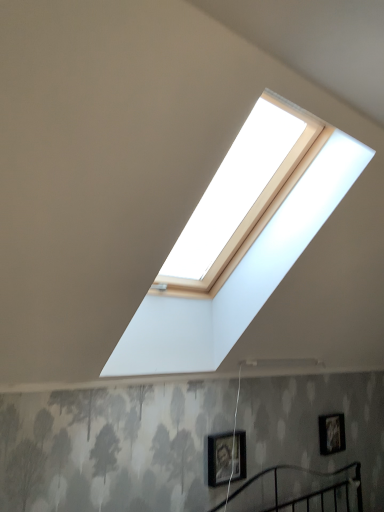
Question: Is matte black picture frame at lower right, marked as the second picture frame in a front-to-back arrangement, in front of or behind matte black picture frame at lower center, the 2th picture frame when ordered from back to front, in the image?

Choices:
 (A) front
 (B) behind

Answer: (B)

Question: Is matte black picture frame at lower right, which is the 1th picture frame from right to left, wider or thinner than matte black picture frame at lower center, the 2th picture frame when ordered from back to front?

Choices:
 (A) thin
 (B) wide

Answer: (A)

Question: Is matte black picture frame at lower right, which is the 1th picture frame from right to left, bigger or smaller than matte black picture frame at lower center, the 2th picture frame when ordered from back to front?

Choices:
 (A) big
 (B) small

Answer: (B)

Question: Looking at their shapes, would you say matte black picture frame at lower center, the 2th picture frame when ordered from back to front, is wider or thinner than matte black picture frame at lower right, the first picture frame viewed from the back?

Choices:
 (A) wide
 (B) thin

Answer: (A)

Question: From a real-world perspective, is matte black picture frame at lower center, the second picture frame when ordered from right to left, positioned above or below matte black picture frame at lower right, which is the 1th picture frame from right to left?

Choices:
 (A) below
 (B) above

Answer: (A)

Question: Considering their positions, is matte black picture frame at lower center, which appears as the 1th picture frame when viewed from the left, located in front of or behind matte black picture frame at lower right, which is the 1th picture frame from right to left?

Choices:
 (A) behind
 (B) front

Answer: (B)

Question: Looking at the image, does matte black picture frame at lower center, which appears as the 1th picture frame when viewed from the left, seem bigger or smaller compared to matte black picture frame at lower right, which is the 1th picture frame from right to left?

Choices:
 (A) big
 (B) small

Answer: (A)